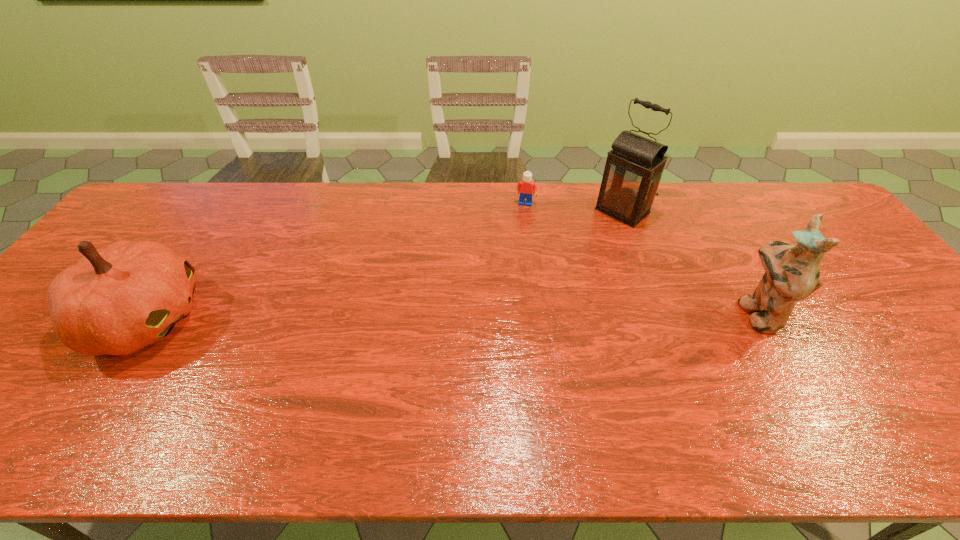
Identify the location of blank region between the pumpkin and the second object from left to right. (336, 261).

Where is `vacant space that is in between the figurine and the pumpkin`? This screenshot has width=960, height=540. vacant space that is in between the figurine and the pumpkin is located at coordinates (451, 316).

The width and height of the screenshot is (960, 540). Identify the location of vacant area that lies between the tallest object and the shortest object. [x=574, y=207].

Where is `object that can be found as the second closest to the second object from right to left`? The height and width of the screenshot is (540, 960). object that can be found as the second closest to the second object from right to left is located at coordinates (792, 273).

Select which object appears as the second closest to the leftmost object. Please provide its 2D coordinates. Your answer should be formatted as a tuple, i.e. [(x, y)], where the tuple contains the x and y coordinates of a point satisfying the conditions above.

[(633, 170)]

Where is `vacant space that satisfies the following two spatial constraints: 1. on the front side of the shortest object; 2. on the left side of the tallest object`? vacant space that satisfies the following two spatial constraints: 1. on the front side of the shortest object; 2. on the left side of the tallest object is located at coordinates (526, 211).

This screenshot has height=540, width=960. Identify the location of vacant space that satisfies the following two spatial constraints: 1. on the front side of the rightmost object; 2. on the front-facing side of the second object from left to right. (539, 313).